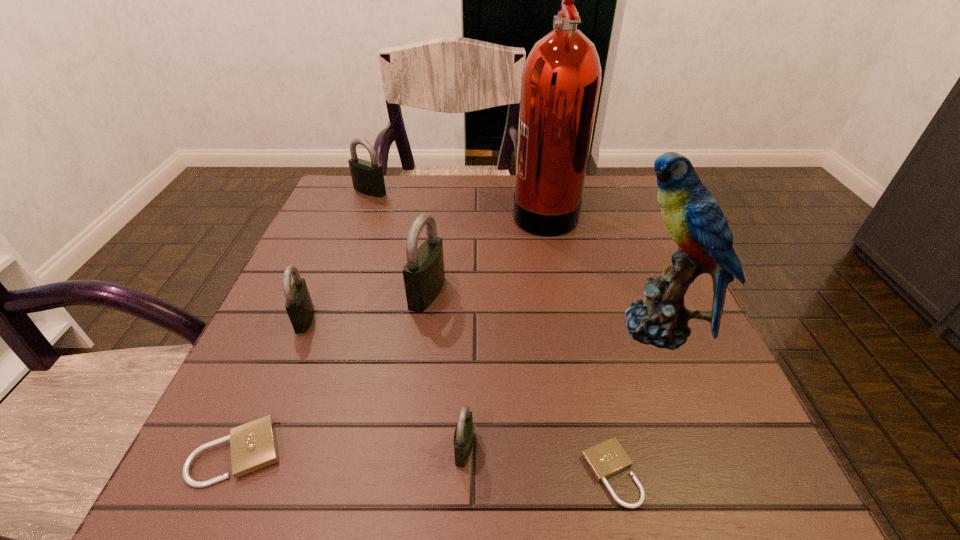
Where is `free space that is in between the fourth shortest object and the fifth shortest padlock`? free space that is in between the fourth shortest object and the fifth shortest padlock is located at coordinates (337, 255).

In order to click on object that ranks as the seventh closest to the right beige padlock in this screenshot , I will do `click(367, 177)`.

You are a GUI agent. You are given a task and a screenshot of the screen. Output one action in this format:
    pyautogui.click(x=<x>, y=<y>)
    Task: Click on the object that ranks as the fifth closest to the fourth shortest padlock
    The image size is (960, 540).
    Given the screenshot: What is the action you would take?
    pyautogui.click(x=561, y=78)

The width and height of the screenshot is (960, 540). I want to click on padlock identified as the second closest to the left beige padlock, so click(463, 437).

This screenshot has height=540, width=960. I want to click on padlock that is the fourth nearest to the fifth shortest padlock, so click(x=463, y=437).

Choose which black padlock is the nearest neighbor to the shortest object. Please provide its 2D coordinates. Your answer should be formatted as a tuple, i.e. [(x, y)], where the tuple contains the x and y coordinates of a point satisfying the conditions above.

[(463, 437)]

Identify which black padlock is the second closest to the shortest padlock. Please provide its 2D coordinates. Your answer should be formatted as a tuple, i.e. [(x, y)], where the tuple contains the x and y coordinates of a point satisfying the conditions above.

[(424, 275)]

Locate an element on the screen. blank space that satisfies the following two spatial constraints: 1. on the back side of the fourth object from left to right; 2. on the right side of the fourth shortest padlock is located at coordinates (315, 293).

You are a GUI agent. You are given a task and a screenshot of the screen. Output one action in this format:
    pyautogui.click(x=<x>, y=<y>)
    Task: Click on the blank space that satisfies the following two spatial constraints: 1. on the front side of the shortest object; 2. on the left side of the sixth tallest object
    The image size is (960, 540).
    Given the screenshot: What is the action you would take?
    pyautogui.click(x=464, y=474)